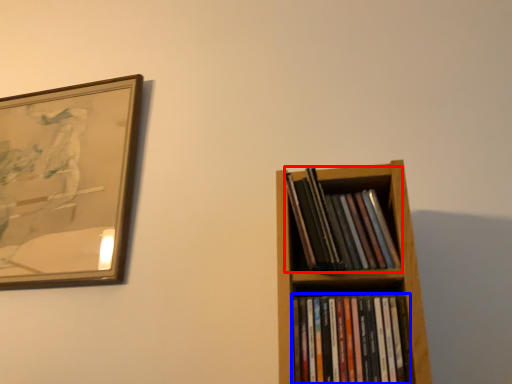
Question: Which point is further to the camera, book (highlighted by a red box) or book (highlighted by a blue box)?

Choices:
 (A) book
 (B) book

Answer: (A)